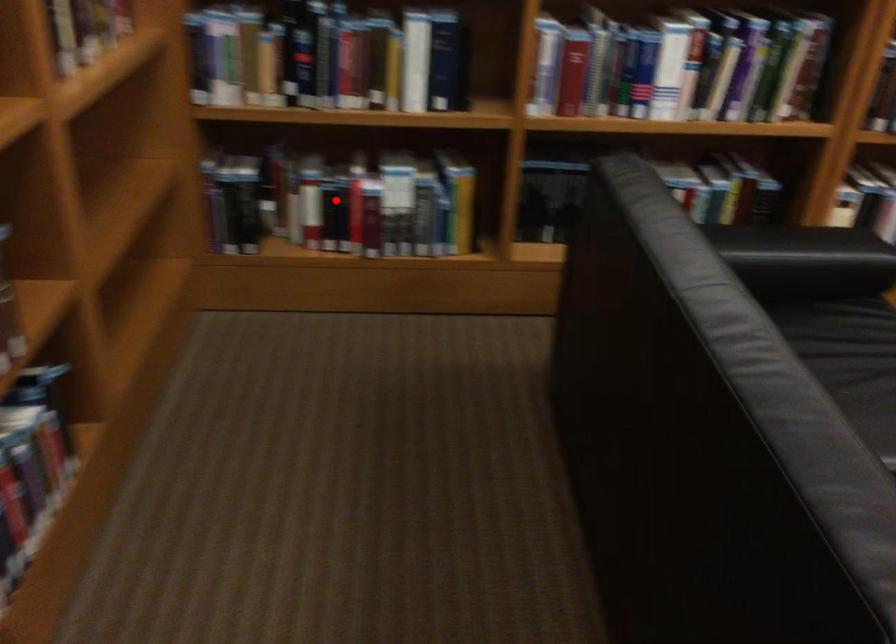
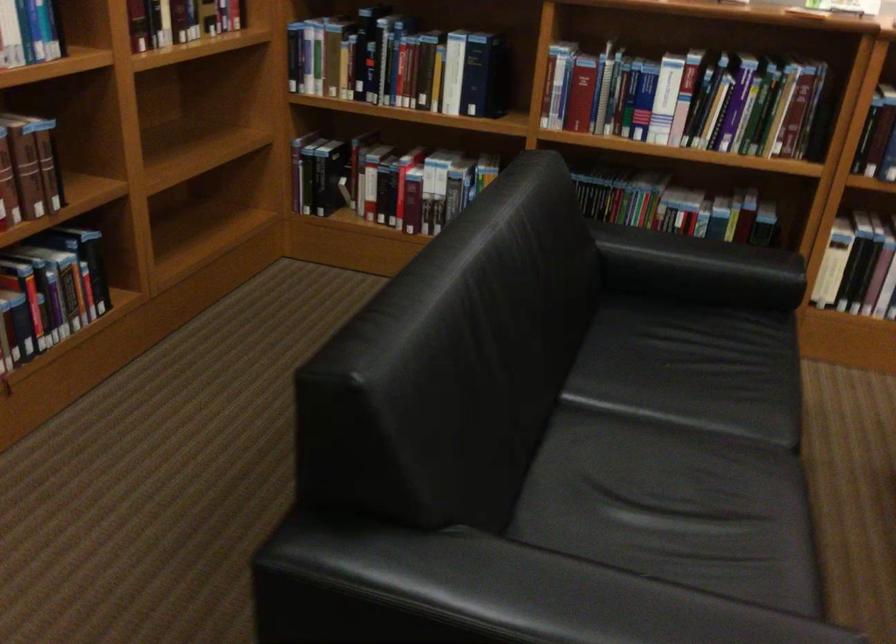
Question: I am providing you with two images of the same scene from different viewpoints. Given a red point in image1, look at the same physical point in image2. Is it:

Choices:
 (A) Closer to the viewpoint
 (B) Farther from the viewpoint

Answer: (B)